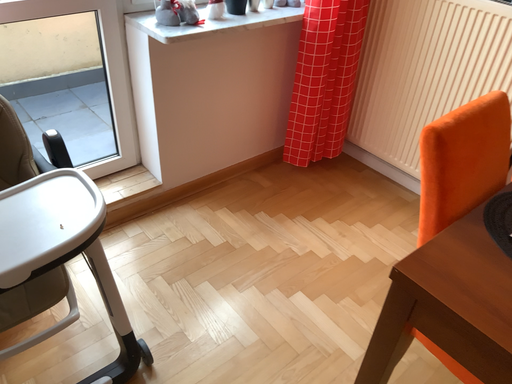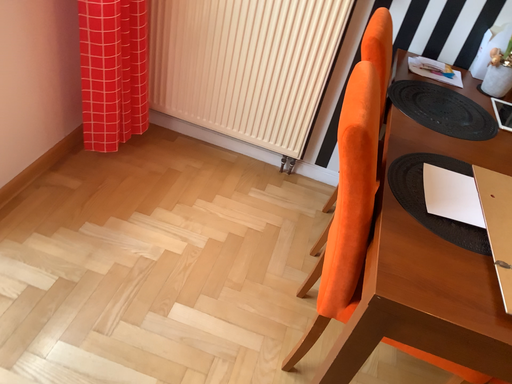
Question: How did the camera likely rotate when shooting the video?

Choices:
 (A) rotated left
 (B) rotated right

Answer: (B)